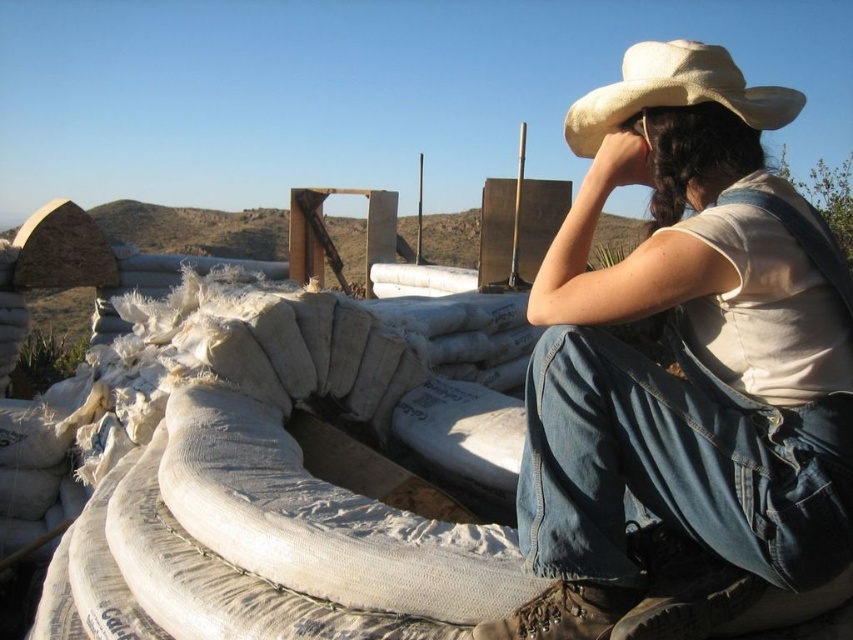
You are standing at the origin point in the image. A point labeled as point (x=682, y=355) is marked. What object is located at that point?

The point (x=682, y=355) indicates white denim overalls at upper right.

You are a photographer trying to capture the white denim overalls at upper right and the beige fabric cowboy hat at upper right in a single frame. Based on their sizes, which object should you focus on first to ensure both fit in the frame?

The white denim overalls at upper right is bigger than the beige fabric cowboy hat at upper right, so you should focus on the white denim overalls at upper right first to ensure both fit in the frame.